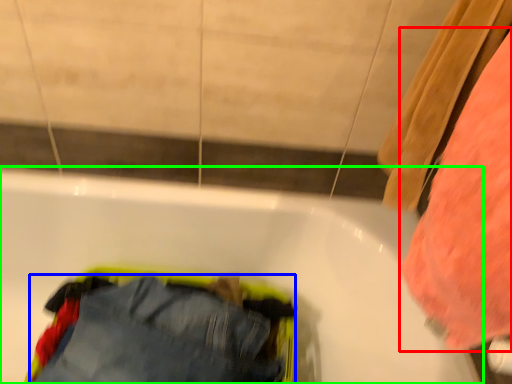
Question: Estimate the real-world distances between objects in this image. Which object is farther from clothing (highlighted by a red box), trousers (highlighted by a blue box) or bathtub (highlighted by a green box)?

Choices:
 (A) trousers
 (B) bathtub

Answer: (A)